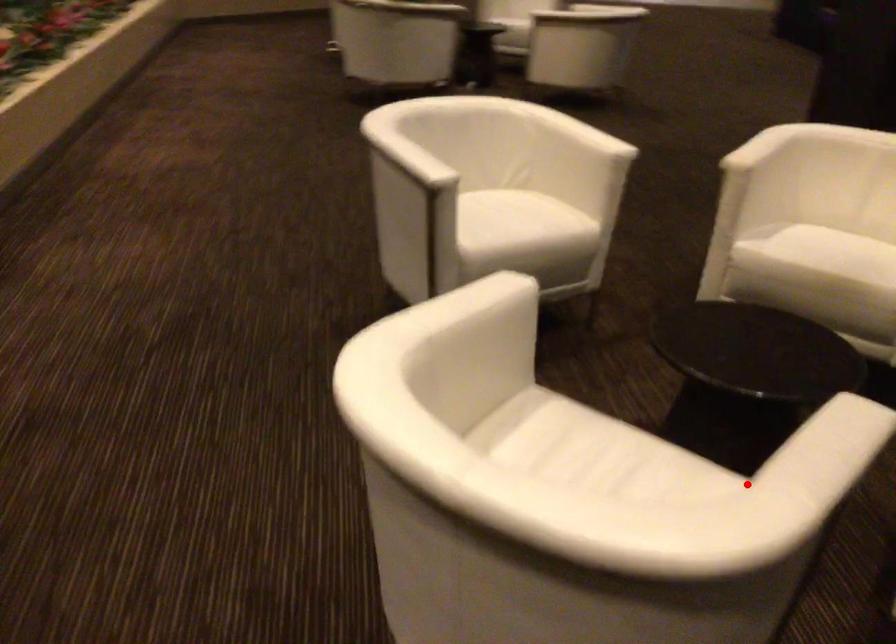
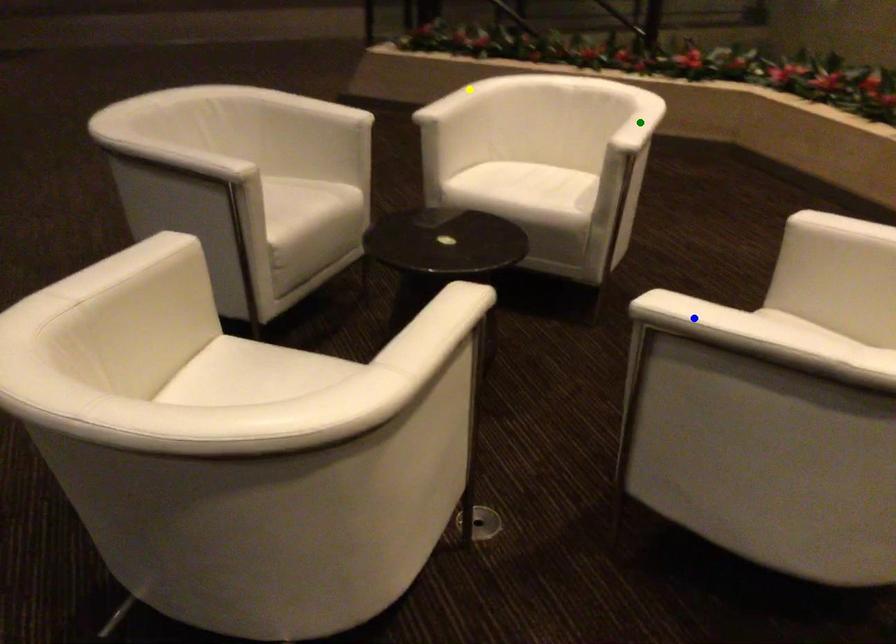
Question: I am providing you with two images of the same scene from different viewpoints. A red point is marked on the first image. You are given multiple points on the second image. Which point in image 2 represents the same 3d spot as the red point in image 1?

Choices:
 (A) blue point
 (B) yellow point
 (C) green point

Answer: (B)